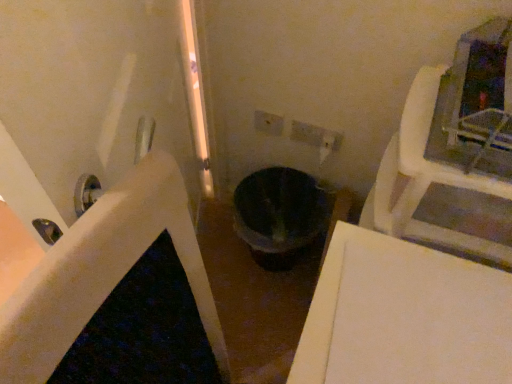
Question: In the image, is black glossy bath at center on the left side or the right side of white plastic electric outlet at center?

Choices:
 (A) right
 (B) left

Answer: (B)

Question: In the image, is black glossy bath at center positioned in front of or behind white plastic electric outlet at center?

Choices:
 (A) behind
 (B) front

Answer: (A)

Question: Based on their relative distances, which object is nearer to the black glossy bath at center?

Choices:
 (A) black matte toilet bowl at center
 (B) white plastic electric outlet at center

Answer: (A)

Question: Considering the real-world distances, which object is closest to the black glossy bath at center?

Choices:
 (A) black matte toilet bowl at center
 (B) white plastic electric outlet at center

Answer: (A)